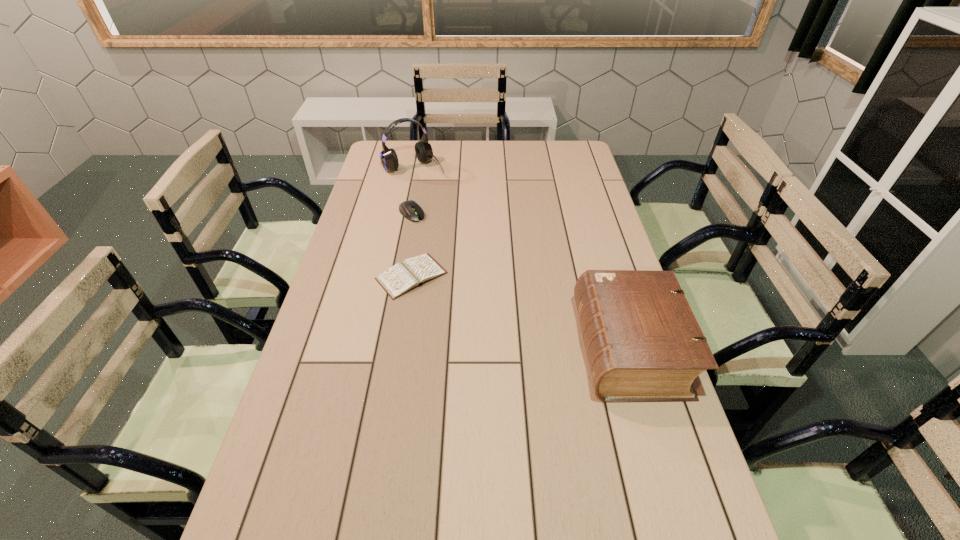
I want to click on the third farthest object, so click(402, 277).

Locate an element on the screen. diary is located at coordinates (402, 277).

You are a GUI agent. You are given a task and a screenshot of the screen. Output one action in this format:
    pyautogui.click(x=<x>, y=<y>)
    Task: Click on the second tallest object
    
    Given the screenshot: What is the action you would take?
    pyautogui.click(x=643, y=342)

I want to click on the rightmost object, so click(x=643, y=342).

Find the location of `computer mouse`. computer mouse is located at coordinates (409, 209).

Find the location of `the second farthest object`. the second farthest object is located at coordinates (409, 209).

Image resolution: width=960 pixels, height=540 pixels. Find the location of `the farthest object`. the farthest object is located at coordinates (389, 160).

At what (x,y) coordinates should I click in order to perform the action: click on the tallest object. Please return your answer as a coordinate pair (x, y). The height and width of the screenshot is (540, 960). Looking at the image, I should click on (389, 160).

Locate an element on the screen. This screenshot has height=540, width=960. vacant area situated on the front of the shortest object is located at coordinates (391, 403).

Identify the location of free region located on the spine side of the nearest object. (516, 348).